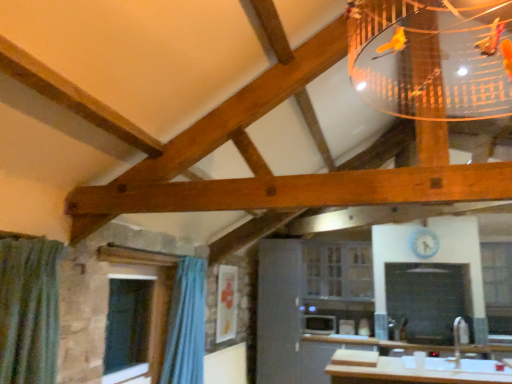
Question: From a real-world perspective, is clear glass window at lower left, which ranks as the first window in front-to-back order, positioned under clear glass cabinet at center, which appears as the 1th window when viewed from the back, based on gravity?

Choices:
 (A) no
 (B) yes

Answer: (B)

Question: Can you confirm if clear glass window at lower left, which ranks as the first window in front-to-back order, is positioned to the right of clear glass cabinet at center, acting as the 2th window starting from the right?

Choices:
 (A) yes
 (B) no

Answer: (B)

Question: Is clear glass window at lower left, the third window viewed from the back, bigger than clear glass cabinet at center, acting as the 2th window starting from the right?

Choices:
 (A) yes
 (B) no

Answer: (B)

Question: Does clear glass window at lower left, which is the first window from left to right, come behind clear glass cabinet at center, which appears as the 1th window when viewed from the back?

Choices:
 (A) no
 (B) yes

Answer: (A)

Question: Is clear glass window at lower left, which ranks as the first window in front-to-back order, taller than clear glass cabinet at center, acting as the 2th window starting from the right?

Choices:
 (A) yes
 (B) no

Answer: (A)

Question: Does clear glass window at lower left, which is the first window from left to right, have a smaller size compared to clear glass cabinet at center, which appears as the 1th window when viewed from the back?

Choices:
 (A) no
 (B) yes

Answer: (B)

Question: Considering the relative sizes of white glossy microwave at center and clear glass window at center, the third window when ordered from left to right, in the image provided, is white glossy microwave at center wider than clear glass window at center, the third window when ordered from left to right,?

Choices:
 (A) no
 (B) yes

Answer: (A)

Question: Would you say white glossy microwave at center contains clear glass window at center, the third window when ordered from left to right?

Choices:
 (A) yes
 (B) no

Answer: (B)

Question: Can you confirm if white glossy microwave at center is positioned to the right of clear glass window at center, the third window when ordered from left to right?

Choices:
 (A) yes
 (B) no

Answer: (B)

Question: Considering the relative sizes of white glossy microwave at center and clear glass window at center, the third window when ordered from left to right, in the image provided, is white glossy microwave at center bigger than clear glass window at center, the third window when ordered from left to right,?

Choices:
 (A) yes
 (B) no

Answer: (B)

Question: Is white glossy microwave at center to the left of clear glass window at center, the third window when ordered from left to right, from the viewer's perspective?

Choices:
 (A) yes
 (B) no

Answer: (A)

Question: Is white glossy microwave at center oriented away from clear glass window at center, which is the first window in right-to-left order?

Choices:
 (A) yes
 (B) no

Answer: (B)

Question: Is blue fabric curtain at lower left aimed at clear glass window at lower left, which is the first window from left to right?

Choices:
 (A) no
 (B) yes

Answer: (A)